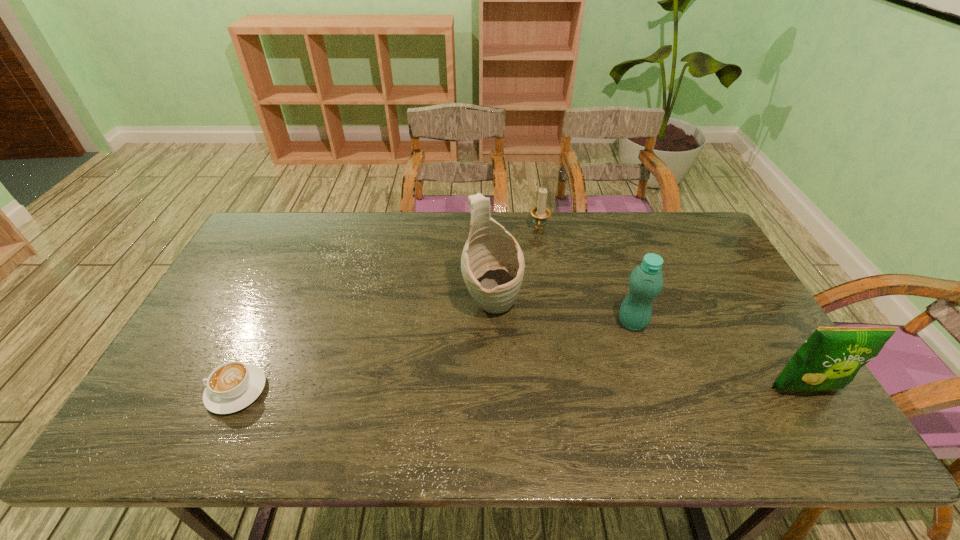
Identify the location of free region located 0.050m on the side of the leftmost object with the handle. Image resolution: width=960 pixels, height=540 pixels. (187, 391).

Where is `vacant space located on the handle side of the farthest object`? Image resolution: width=960 pixels, height=540 pixels. vacant space located on the handle side of the farthest object is located at coordinates (531, 277).

This screenshot has height=540, width=960. I want to click on free space located on the handle side of the farthest object, so click(537, 249).

Identify the location of free spot located on the handle side of the farthest object. (537, 247).

Where is `free point located 0.090m at the spout of the tallest object`? free point located 0.090m at the spout of the tallest object is located at coordinates (522, 347).

Where is `free space located at the spout of the tallest object`? free space located at the spout of the tallest object is located at coordinates (558, 397).

Locate an element on the screen. This screenshot has height=540, width=960. free region located at the spout of the tallest object is located at coordinates (518, 342).

Where is `blank space located at the front cap of the second object from right to left`? The image size is (960, 540). blank space located at the front cap of the second object from right to left is located at coordinates (546, 394).

The height and width of the screenshot is (540, 960). In order to click on free space located at the front cap of the second object from right to left in this screenshot , I will do `click(546, 394)`.

At what (x,y) coordinates should I click in order to perform the action: click on free space located 0.050m at the front cap of the second object from right to left. Please return your answer as a coordinate pair (x, y). The height and width of the screenshot is (540, 960). Looking at the image, I should click on (612, 340).